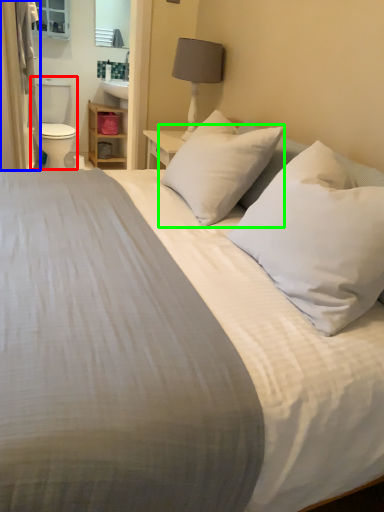
Question: Estimate the real-world distances between objects in this image. Which object is farther from toilet bowl (highlighted by a red box), curtain (highlighted by a blue box) or pillow (highlighted by a green box)?

Choices:
 (A) curtain
 (B) pillow

Answer: (B)